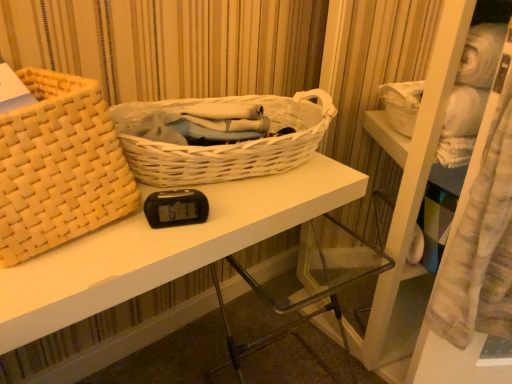
Question: From the image's perspective, is matte woven picnic basket at left, the 2th picnic basket when ordered from right to left, on top of white woven basket at upper left?

Choices:
 (A) yes
 (B) no

Answer: (A)

Question: Does matte woven picnic basket at left, positioned as the 1th picnic basket in left-to-right order, touch white woven basket at upper left?

Choices:
 (A) yes
 (B) no

Answer: (B)

Question: Could white woven basket at upper left be considered to be inside matte woven picnic basket at left, positioned as the 1th picnic basket in left-to-right order?

Choices:
 (A) yes
 (B) no

Answer: (B)

Question: Is matte woven picnic basket at left, positioned as the 1th picnic basket in left-to-right order, oriented towards white woven basket at upper left?

Choices:
 (A) yes
 (B) no

Answer: (B)

Question: Is matte woven picnic basket at left, the 2th picnic basket when ordered from right to left, positioned behind white woven basket at upper left?

Choices:
 (A) no
 (B) yes

Answer: (A)

Question: Considering the relative sizes of matte woven picnic basket at left, positioned as the 1th picnic basket in left-to-right order, and white woven basket at upper left in the image provided, is matte woven picnic basket at left, positioned as the 1th picnic basket in left-to-right order, smaller than white woven basket at upper left?

Choices:
 (A) yes
 (B) no

Answer: (A)

Question: Is white woven basket at upper left surrounding white wicker basket at center, acting as the 2th picnic basket starting from the left?

Choices:
 (A) no
 (B) yes

Answer: (A)

Question: From the image's perspective, would you say white woven basket at upper left is shown under white wicker basket at center, arranged as the first picnic basket when viewed from the right?

Choices:
 (A) no
 (B) yes

Answer: (B)

Question: Is white woven basket at upper left taller than white wicker basket at center, acting as the 2th picnic basket starting from the left?

Choices:
 (A) yes
 (B) no

Answer: (A)

Question: Can you confirm if white woven basket at upper left is wider than white wicker basket at center, arranged as the first picnic basket when viewed from the right?

Choices:
 (A) no
 (B) yes

Answer: (B)

Question: Can you confirm if white woven basket at upper left is bigger than white wicker basket at center, acting as the 2th picnic basket starting from the left?

Choices:
 (A) yes
 (B) no

Answer: (A)

Question: Is the position of white woven basket at upper left more distant than that of white wicker basket at center, arranged as the first picnic basket when viewed from the right?

Choices:
 (A) yes
 (B) no

Answer: (B)

Question: Can you confirm if white wicker basket at center, acting as the 2th picnic basket starting from the left, is bigger than white woven basket at upper left?

Choices:
 (A) yes
 (B) no

Answer: (B)